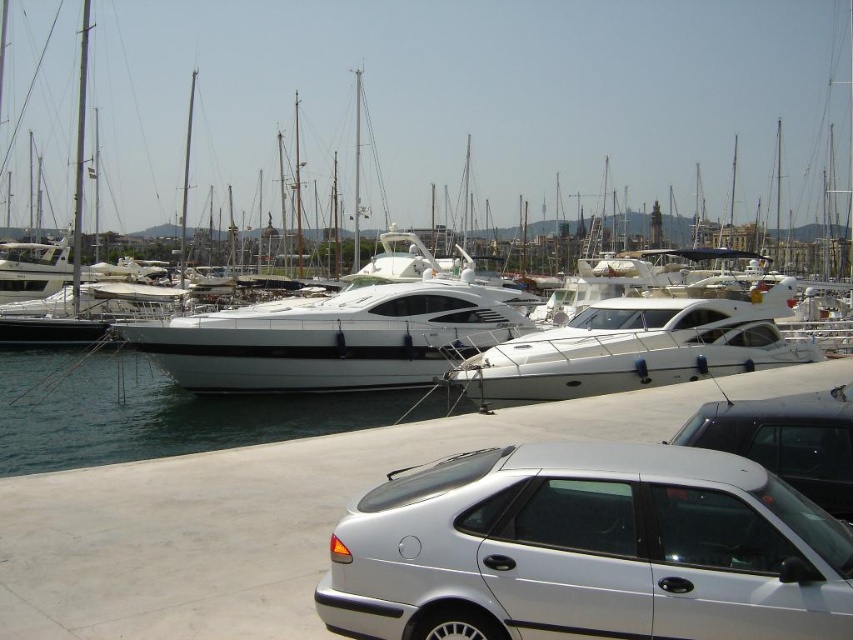
Question: Does white glossy yacht at center have a smaller size compared to silver metallic car at lower right?

Choices:
 (A) yes
 (B) no

Answer: (B)

Question: Based on their relative distances, which object is farther from the satin silver sedan at lower right?

Choices:
 (A) silver metallic car at lower right
 (B) white glossy yacht at center
 (C) white glossy water at center

Answer: (B)

Question: Does white glossy yacht at center have a smaller size compared to white glossy water at center?

Choices:
 (A) yes
 (B) no

Answer: (B)

Question: In this image, where is white glossy water at center located relative to satin silver sedan at lower right?

Choices:
 (A) right
 (B) left

Answer: (B)

Question: Which of these objects is positioned farthest from the silver metallic car at lower right?

Choices:
 (A) satin silver sedan at lower right
 (B) white glossy yacht at center

Answer: (B)

Question: Which point is farther to the camera?

Choices:
 (A) (495, 595)
 (B) (839, 445)
 (C) (16, 440)

Answer: (C)